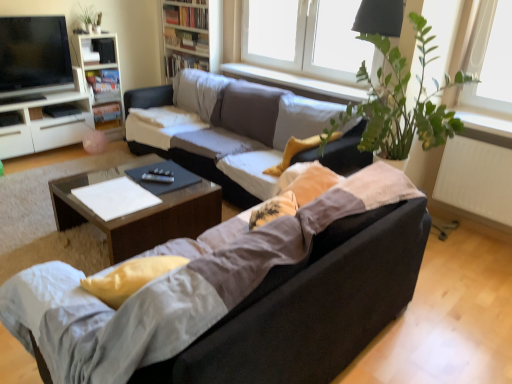
Locate an element on the screen. Image resolution: width=512 pixels, height=384 pixels. matte black couch at center, acting as the first studio couch starting from the front is located at coordinates (182, 286).

What do you see at coordinates (306, 37) in the screenshot? I see `white plastic window at upper center` at bounding box center [306, 37].

Where is `matte black coffee table at center`? matte black coffee table at center is located at coordinates (139, 212).

What is the approximate width of white smooth window sill at upper center?

The width of white smooth window sill at upper center is 10.75 inches.

What is the approximate width of white matte radiator at right?

It is 8.90 inches.

The image size is (512, 384). In order to click on matte black couch at center, which is the second studio couch from back to front in this screenshot , I will do `click(182, 286)`.

Considering the positions of objects wooden bookshelf at upper center, which is counted as the 2th bookshelf, starting from the left, and white smooth window sill at upper center in the image provided, who is more to the right, wooden bookshelf at upper center, which is counted as the 2th bookshelf, starting from the left, or white smooth window sill at upper center?

white smooth window sill at upper center is more to the right.

Is wooden bookshelf at upper center, which is counted as the 2th bookshelf, starting from the left, not near white smooth window sill at upper center?

No, wooden bookshelf at upper center, which is counted as the 2th bookshelf, starting from the left, is not far away from white smooth window sill at upper center.

Between point (167, 47) and point (244, 64), which one is positioned behind?

The point (167, 47) is farther.

Considering the relative sizes of wooden bookshelf at upper center, which is the first bookshelf from right to left, and white smooth window sill at upper center in the image provided, is wooden bookshelf at upper center, which is the first bookshelf from right to left, bigger than white smooth window sill at upper center?

Yes, wooden bookshelf at upper center, which is the first bookshelf from right to left, is bigger than white smooth window sill at upper center.

From the image's perspective, is white glossy cabinet at left located beneath white glossy bookshelf at upper left, the second bookshelf positioned from the right?

Indeed, from the image's perspective, white glossy cabinet at left is shown beneath white glossy bookshelf at upper left, the second bookshelf positioned from the right.

Would you say white glossy cabinet at left is outside white glossy bookshelf at upper left, the first bookshelf when ordered from left to right?

Indeed, white glossy cabinet at left is completely outside white glossy bookshelf at upper left, the first bookshelf when ordered from left to right.

Is white glossy cabinet at left wider than white glossy bookshelf at upper left, the first bookshelf when ordered from left to right?

Correct, the width of white glossy cabinet at left exceeds that of white glossy bookshelf at upper left, the first bookshelf when ordered from left to right.

This screenshot has width=512, height=384. I want to click on bookshelf that is the 1st one when counting upward from the white glossy cabinet at left (from the image's perspective), so click(101, 76).

From the image's perspective, would you say matte black couch at center, acting as the first studio couch starting from the front, is positioned over white matte radiator at right?

No, from the image's perspective, matte black couch at center, acting as the first studio couch starting from the front, is not over white matte radiator at right.

Considering the sizes of objects matte black couch at center, acting as the first studio couch starting from the front, and white matte radiator at right in the image provided, who is taller, matte black couch at center, acting as the first studio couch starting from the front, or white matte radiator at right?

With more height is matte black couch at center, acting as the first studio couch starting from the front.

Who is smaller, matte black couch at center, acting as the first studio couch starting from the front, or white matte radiator at right?

Smaller between the two is white matte radiator at right.

Measure the distance between matte black couch at center, acting as the first studio couch starting from the front, and white matte radiator at right.

A distance of 5.29 feet exists between matte black couch at center, acting as the first studio couch starting from the front, and white matte radiator at right.

Is point (300, 93) positioned after point (98, 77)?

No, (300, 93) is closer to viewer.

From a real-world perspective, is white smooth window sill at upper center above or below white glossy bookshelf at upper left, the second bookshelf positioned from the right?

Clearly, from a real-world perspective, white smooth window sill at upper center is above white glossy bookshelf at upper left, the second bookshelf positioned from the right.

How many degrees apart are the facing directions of white smooth window sill at upper center and white glossy bookshelf at upper left, the first bookshelf when ordered from left to right?

91.6 degrees separate the facing orientations of white smooth window sill at upper center and white glossy bookshelf at upper left, the first bookshelf when ordered from left to right.

From the image's perspective, who appears lower, white smooth window sill at upper center or white glossy bookshelf at upper left, the second bookshelf positioned from the right?

white smooth window sill at upper center appears lower in the image.

From a real-world perspective, relative to matte black tv at upper left, is wooden bookshelf at upper center, which is the first bookshelf from right to left, vertically above or below?

wooden bookshelf at upper center, which is the first bookshelf from right to left, is above matte black tv at upper left.

Considering the sizes of objects wooden bookshelf at upper center, which is counted as the 2th bookshelf, starting from the left, and matte black tv at upper left in the image provided, who is shorter, wooden bookshelf at upper center, which is counted as the 2th bookshelf, starting from the left, or matte black tv at upper left?

With less height is matte black tv at upper left.

Is wooden bookshelf at upper center, which is counted as the 2th bookshelf, starting from the left, positioned beyond the bounds of matte black tv at upper left?

wooden bookshelf at upper center, which is counted as the 2th bookshelf, starting from the left, lies outside matte black tv at upper left's area.

Is wooden bookshelf at upper center, which is the first bookshelf from right to left, far from matte black tv at upper left?

Yes, wooden bookshelf at upper center, which is the first bookshelf from right to left, and matte black tv at upper left are quite far apart.

In the scene shown: Would you say white matte radiator at right is a long distance from white smooth window sill at upper center?

white matte radiator at right is positioned a significant distance from white smooth window sill at upper center.

Does white matte radiator at right contain white smooth window sill at upper center?

Actually, white smooth window sill at upper center is outside white matte radiator at right.

Is white smooth window sill at upper center at the back of white matte radiator at right?

No, white smooth window sill at upper center is not at the back of white matte radiator at right.

Relative to white smooth window sill at upper center, is white matte radiator at right in front or behind?

Visually, white matte radiator at right is located in front of white smooth window sill at upper center.

Is white smooth window sill at upper center located within matte gray couch at center, which is the 1th studio couch in back-to-front order?

No, matte gray couch at center, which is the 1th studio couch in back-to-front order, does not contain white smooth window sill at upper center.

In the image, is matte gray couch at center, which is the 1th studio couch in back-to-front order, positioned in front of or behind white smooth window sill at upper center?

Visually, matte gray couch at center, which is the 1th studio couch in back-to-front order, is located in front of white smooth window sill at upper center.

From the image's perspective, which one is positioned lower, matte gray couch at center, marked as the second studio couch in a front-to-back arrangement, or white smooth window sill at upper center?

From the image's view, matte gray couch at center, marked as the second studio couch in a front-to-back arrangement, is below.

Does matte gray couch at center, which is the 1th studio couch in back-to-front order, appear on the right side of white smooth window sill at upper center?

In fact, matte gray couch at center, which is the 1th studio couch in back-to-front order, is to the left of white smooth window sill at upper center.

At what (x,y) coordinates should I click in order to perform the action: click on bookshelf above the white smooth window sill at upper center (from a real-world perspective). Please return your answer as a coordinate pair (x, y). Looking at the image, I should click on (192, 35).

Where is `cabinetry on the left of white glossy bookshelf at upper left, the second bookshelf positioned from the right`? This screenshot has height=384, width=512. cabinetry on the left of white glossy bookshelf at upper left, the second bookshelf positioned from the right is located at coordinates (45, 125).

Based on their spatial positions, is matte black coffee table at center or white smooth window sill at upper center further from matte black couch at center, acting as the first studio couch starting from the front?

white smooth window sill at upper center.

Based on their spatial positions, is wooden bookshelf at upper center, which is counted as the 2th bookshelf, starting from the left, or matte black tv at upper left closer to matte gray couch at center, which is the 1th studio couch in back-to-front order?

The object closer to matte gray couch at center, which is the 1th studio couch in back-to-front order, is wooden bookshelf at upper center, which is counted as the 2th bookshelf, starting from the left.

When comparing their distances from matte black coffee table at center, does matte black couch at center, acting as the first studio couch starting from the front, or matte gray couch at center, which is the 1th studio couch in back-to-front order, seem closer?

Based on the image, matte gray couch at center, which is the 1th studio couch in back-to-front order, appears to be nearer to matte black coffee table at center.

Looking at the image, which one is located further to white glossy bookshelf at upper left, the first bookshelf when ordered from left to right, matte black couch at center, which is the second studio couch from back to front, or white plastic window at upper center?

matte black couch at center, which is the second studio couch from back to front, lies further to white glossy bookshelf at upper left, the first bookshelf when ordered from left to right, than the other object.

When comparing their distances from matte gray couch at center, which is the 1th studio couch in back-to-front order, does wooden bookshelf at upper center, which is the first bookshelf from right to left, or white glossy cabinet at left seem closer?

wooden bookshelf at upper center, which is the first bookshelf from right to left, is positioned closer to the anchor matte gray couch at center, which is the 1th studio couch in back-to-front order.

Based on their spatial positions, is matte black couch at center, which is the second studio couch from back to front, or matte gray couch at center, which is the 1th studio couch in back-to-front order, further from white glossy bookshelf at upper left, the second bookshelf positioned from the right?

matte black couch at center, which is the second studio couch from back to front.

From the image, which object appears to be farther from white glossy cabinet at left, matte black couch at center, acting as the first studio couch starting from the front, or white matte radiator at right?

white matte radiator at right lies further to white glossy cabinet at left than the other object.

Estimate the real-world distances between objects in this image. Which object is further from white matte radiator at right, white glossy cabinet at left or wooden bookshelf at upper center, which is counted as the 2th bookshelf, starting from the left?

white glossy cabinet at left is further to white matte radiator at right.

The image size is (512, 384). Identify the location of television positioned between matte black couch at center, acting as the first studio couch starting from the front, and wooden bookshelf at upper center, which is counted as the 2th bookshelf, starting from the left, from near to far. (34, 55).

Image resolution: width=512 pixels, height=384 pixels. Identify the location of coffee table between white glossy bookshelf at upper left, the first bookshelf when ordered from left to right, and white smooth window sill at upper center, in the horizontal direction. (139, 212).

At what (x,y) coordinates should I click in order to perform the action: click on coffee table between matte black tv at upper left and white plastic window at upper center in the horizontal direction. Please return your answer as a coordinate pair (x, y). Looking at the image, I should click on (139, 212).

I want to click on window sill between white glossy cabinet at left and white plastic window at upper center in the horizontal direction, so click(295, 83).